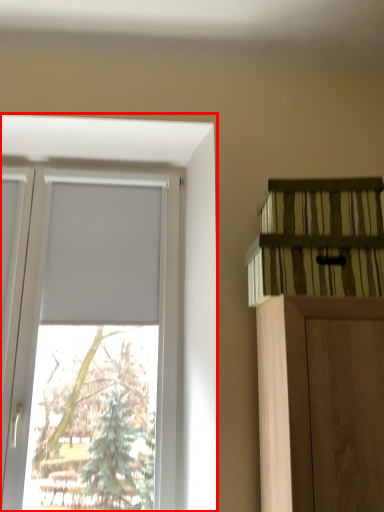
Question: From the image's perspective, where is window (annotated by the red box) located relative to shelf?

Choices:
 (A) above
 (B) below

Answer: (B)